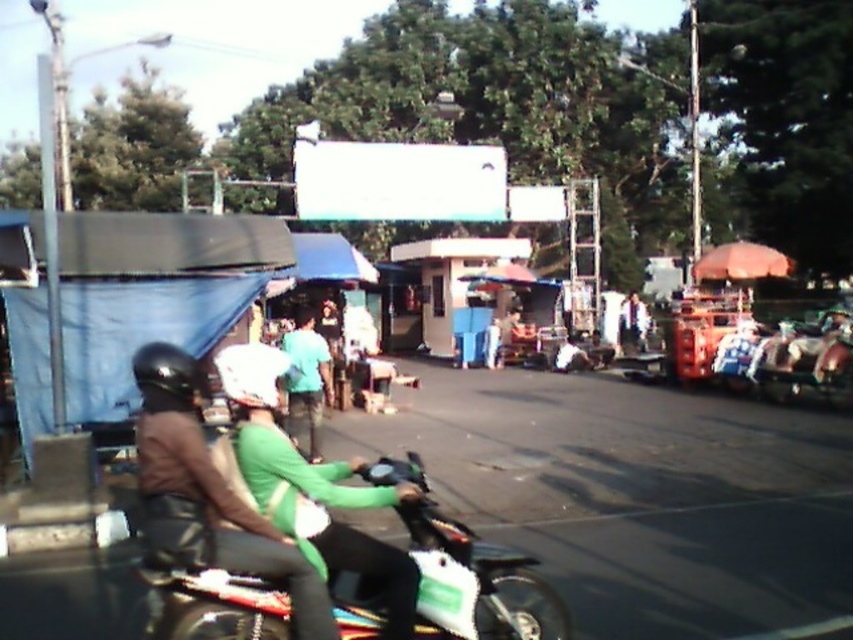
Question: Does matte black helmet at left have a smaller size compared to green matte shirt at center?

Choices:
 (A) yes
 (B) no

Answer: (A)

Question: Which point is farther from the camera taking this photo?

Choices:
 (A) (195, 426)
 (B) (254, 365)
 (C) (148, 564)

Answer: (B)

Question: Which object is the farthest from the white glossy motorcycle at center?

Choices:
 (A) black matte helmet at left
 (B) green matte shirt at center
 (C) white matte helmet at center

Answer: (B)

Question: Does green matte shirt at center appear on the left side of black matte helmet at left?

Choices:
 (A) no
 (B) yes

Answer: (B)

Question: Which point appears farthest from the camera in this image?

Choices:
 (A) (151, 397)
 (B) (262, 598)

Answer: (A)

Question: Considering the relative positions of matte black helmet at left and green matte shirt at center in the image provided, where is matte black helmet at left located with respect to green matte shirt at center?

Choices:
 (A) above
 (B) below

Answer: (B)